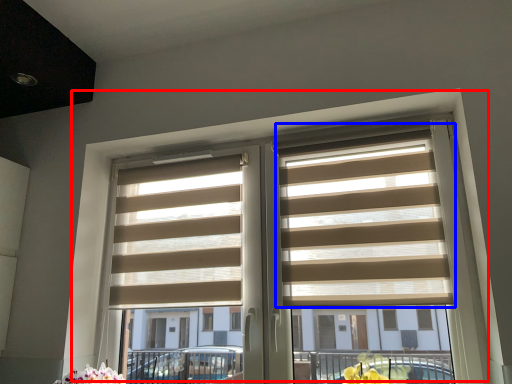
Question: Among these objects, which one is nearest to the camera, window (highlighted by a red box) or blind (highlighted by a blue box)?

Choices:
 (A) window
 (B) blind

Answer: (A)